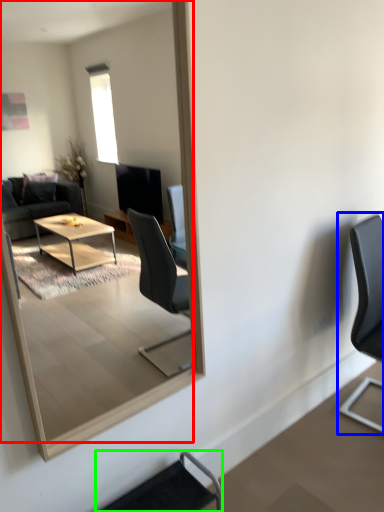
Question: Considering the real-world distances, which object is farthest from mirror (highlighted by a red box)? chair (highlighted by a blue box) or chair (highlighted by a green box)?

Choices:
 (A) chair
 (B) chair

Answer: (A)